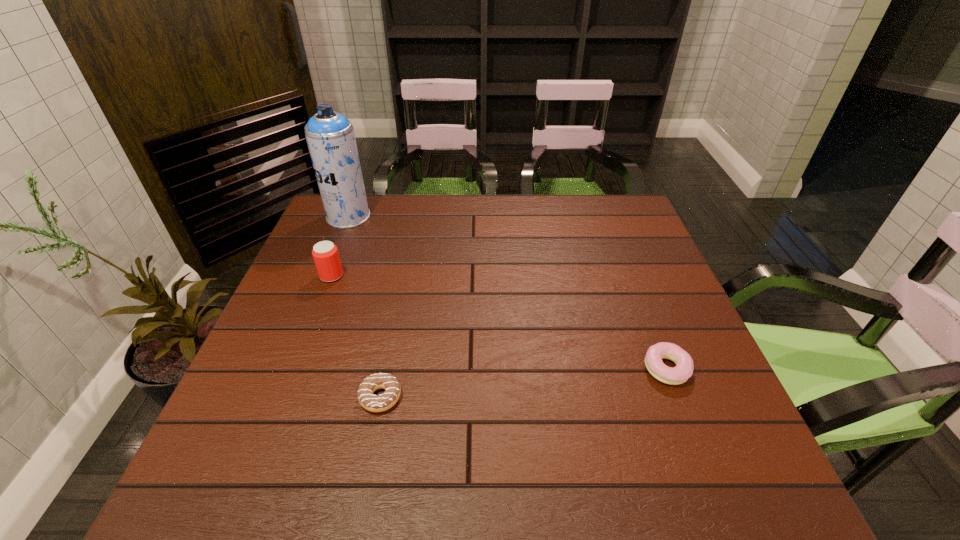
Locate an element on the screen. free region at the far left corner of the desktop is located at coordinates (366, 232).

Identify the location of free region at the far right corner of the desktop. (597, 224).

The width and height of the screenshot is (960, 540). In order to click on free space between the farthest object and the second farthest object in this screenshot , I will do `click(340, 246)`.

Find the location of `free spot between the rightmost object and the tallest object`. free spot between the rightmost object and the tallest object is located at coordinates (508, 293).

I want to click on empty location between the rightmost object and the shorter doughnut, so click(x=523, y=383).

Identify the location of free spot between the left doughnut and the tallest object. (365, 307).

Image resolution: width=960 pixels, height=540 pixels. I want to click on free spot between the third shortest object and the right doughnut, so click(499, 322).

The width and height of the screenshot is (960, 540). I want to click on empty space that is in between the right doughnut and the aerosol can, so click(508, 293).

Where is `empty location between the farthest object and the rightmost object`? The height and width of the screenshot is (540, 960). empty location between the farthest object and the rightmost object is located at coordinates (508, 293).

This screenshot has width=960, height=540. Find the location of `free space that is in between the right doughnut and the third shortest object`. free space that is in between the right doughnut and the third shortest object is located at coordinates (499, 322).